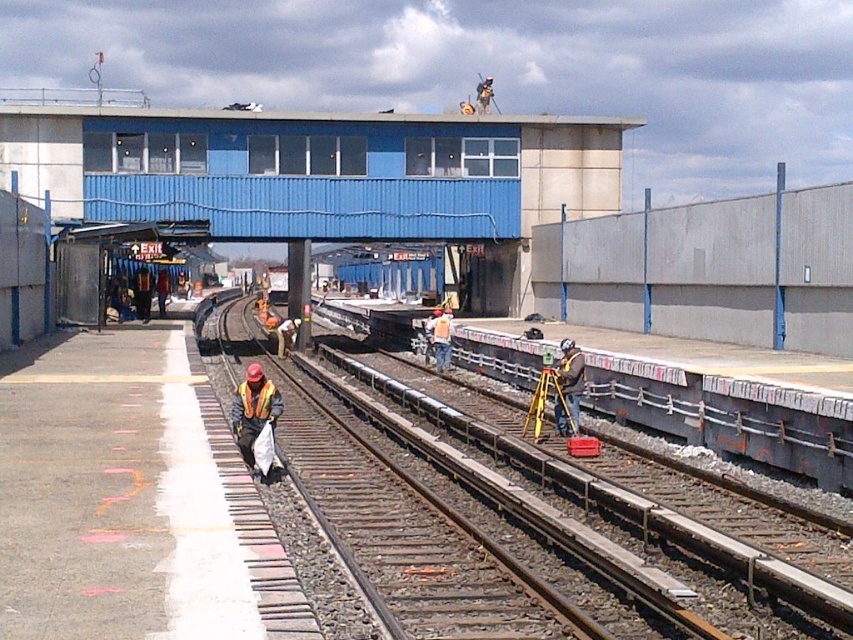
Question: Does reflective orange vest at center have a larger size compared to orange reflective safety vest at lower center?

Choices:
 (A) no
 (B) yes

Answer: (B)

Question: Which of the following is the closest to the observer?

Choices:
 (A) reflective safety vest at center
 (B) hard hat at center
 (C) reflective orange vest at center
 (D) brown metallic train track at center

Answer: (D)

Question: Among these points, which one is nearest to the camera?

Choices:
 (A) (271, 413)
 (B) (242, 390)
 (C) (750, 611)

Answer: (C)

Question: Estimate the real-world distances between objects in this image. Which object is farther from the orange reflective vest at center?

Choices:
 (A) hard hat at center
 (B) brown metallic train track at center
 (C) reflective safety vest at center

Answer: (C)

Question: Can you confirm if reflective orange vest at center is positioned to the left of orange reflective safety vest at lower center?

Choices:
 (A) no
 (B) yes

Answer: (B)

Question: Does brown metallic train track at center have a larger size compared to hard hat at center?

Choices:
 (A) no
 (B) yes

Answer: (B)